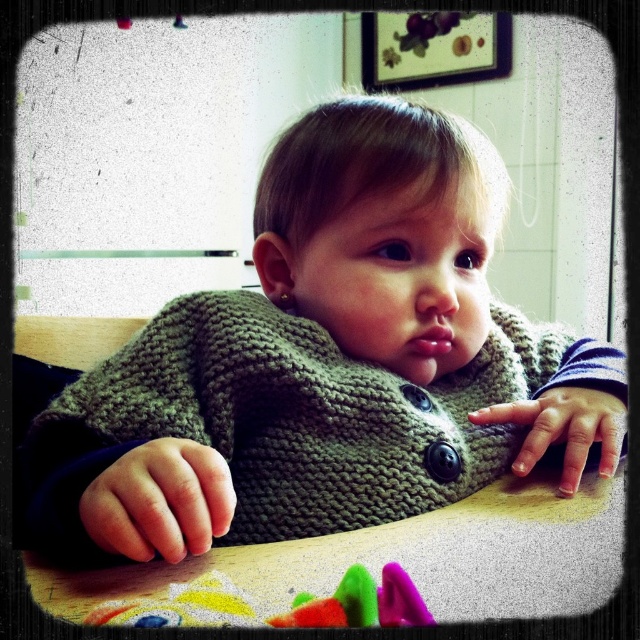
Question: Which point is farther from the camera taking this photo?

Choices:
 (A) (614, 433)
 (B) (625, 396)

Answer: (B)

Question: Can you confirm if knitted green sweater at center is wider than knitted fabric hand at center?

Choices:
 (A) yes
 (B) no

Answer: (A)

Question: Can you confirm if smooth skin hand at center is wider than knitted fabric hand at center?

Choices:
 (A) no
 (B) yes

Answer: (A)

Question: Observing the image, what is the correct spatial positioning of wooden table at center in reference to rubberized plastic toy at lower center?

Choices:
 (A) below
 (B) above

Answer: (A)

Question: Which is nearer to the rubberized plastic toy at lower center?

Choices:
 (A) smooth skin hand at center
 (B) knitted fabric hand at center
 (C) wooden table at center

Answer: (A)

Question: Which object is farther from the camera taking this photo?

Choices:
 (A) wooden table at center
 (B) knitted green sweater at center
 (C) smooth skin hand at center
 (D) knitted fabric hand at center

Answer: (D)